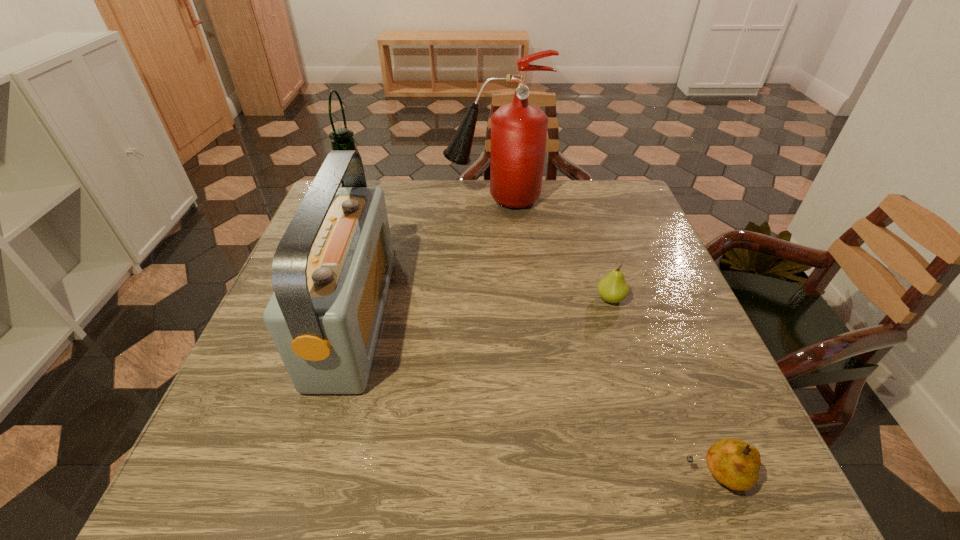
What are the coordinates of `vacant area at the far edge` in the screenshot? It's located at (x=423, y=213).

This screenshot has height=540, width=960. I want to click on free spot at the near edge of the desktop, so click(x=361, y=449).

In the image, there is a desktop. Find the location of `vacant space at the right edge`. vacant space at the right edge is located at coordinates (650, 295).

The height and width of the screenshot is (540, 960). In the image, there is a desktop. Identify the location of vacant space at the far right corner. coord(600,199).

Where is `free region at the near right corner of the desktop`? Image resolution: width=960 pixels, height=540 pixels. free region at the near right corner of the desktop is located at coordinates (762, 449).

What are the coordinates of `vacant area that lies between the lantern and the fire extinguisher` in the screenshot? It's located at (425, 200).

At what (x,y) coordinates should I click in order to perform the action: click on unoccupied area between the radio receiver and the fire extinguisher. Please return your answer as a coordinate pair (x, y). The image size is (960, 540). Looking at the image, I should click on (424, 259).

In order to click on unoccupied area between the third object from left to right and the radio receiver in this screenshot , I will do `click(424, 259)`.

Image resolution: width=960 pixels, height=540 pixels. Identify the location of vacant area between the third object from right to left and the lantern. (425, 200).

This screenshot has height=540, width=960. What are the coordinates of `vacant area that lies between the nearer pear and the radio receiver` in the screenshot? It's located at (x=535, y=397).